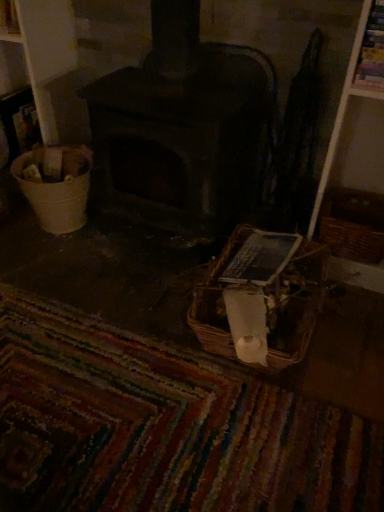
Question: Is dark gray stone wood burning stove at center to the left or to the right of multicolored woven mat at lower center in the image?

Choices:
 (A) left
 (B) right

Answer: (B)

Question: In terms of height, does dark gray stone wood burning stove at center look taller or shorter compared to multicolored woven mat at lower center?

Choices:
 (A) short
 (B) tall

Answer: (B)

Question: Which is farther from the multicolored woven mat at lower center?

Choices:
 (A) woven brown basket at lower center, which is the 2th basket from right to left
 (B) brown woven basket at right, marked as the first basket in a right-to-left arrangement
 (C) dark gray stone wood burning stove at center
 (D) white plastic bucket at left

Answer: (B)

Question: Estimate the real-world distances between objects in this image. Which object is closer to the woven brown basket at lower center, the first basket in the left-to-right sequence?

Choices:
 (A) dark gray stone wood burning stove at center
 (B) brown woven basket at right, which appears as the second basket when viewed from the left
 (C) white plastic bucket at left
 (D) multicolored woven mat at lower center

Answer: (D)